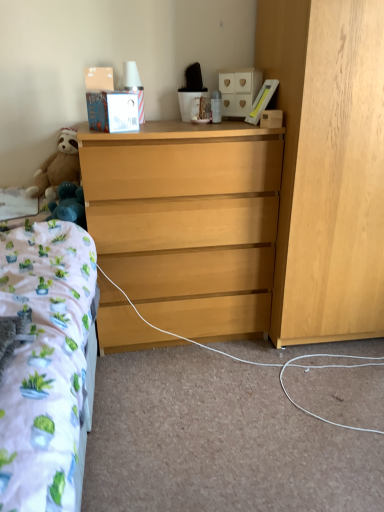
Question: Considering their positions, is light wood dresser at center located in front of or behind brown plush teddy bear at left?

Choices:
 (A) front
 (B) behind

Answer: (A)

Question: From the image's perspective, is light wood dresser at center positioned above or below brown plush teddy bear at left?

Choices:
 (A) above
 (B) below

Answer: (B)

Question: Based on their relative distances, which object is nearer to the light wood dresser at center?

Choices:
 (A) brown plush teddy bear at left
 (B) white matte cabinet at upper center, the 2th cabinetry from the right
 (C) wooden box at upper right
 (D) blue plush toy at left
 (E) light wood dresser at right, which is the 1th cabinetry from bottom to top

Answer: (E)

Question: Which is nearer to the blue plush toy at left?

Choices:
 (A) light wood dresser at right, which is the first cabinetry from right to left
 (B) white matte cabinet at upper center, acting as the 1th cabinetry starting from the top
 (C) light wood dresser at center
 (D) brown plush teddy bear at left
 (E) wooden box at upper right

Answer: (D)